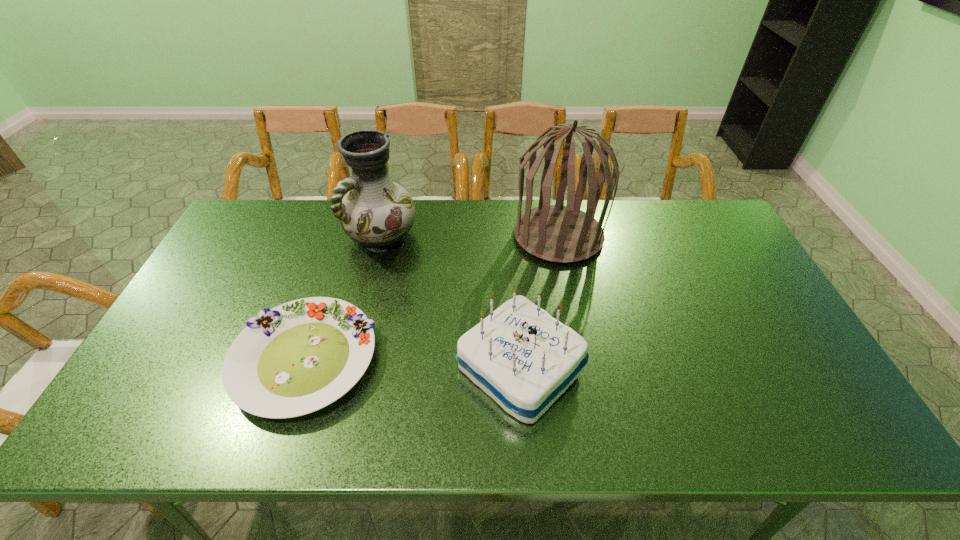
The image size is (960, 540). I want to click on birthday cake that is at the near edge, so click(x=522, y=357).

The width and height of the screenshot is (960, 540). Find the location of `salad plate located at the near edge`. salad plate located at the near edge is located at coordinates (299, 357).

Where is `free space at the far edge of the desktop`? This screenshot has height=540, width=960. free space at the far edge of the desktop is located at coordinates pyautogui.click(x=632, y=215).

In the image, there is a desktop. Where is `vacant region at the near edge`? The image size is (960, 540). vacant region at the near edge is located at coordinates (614, 418).

This screenshot has width=960, height=540. Identify the location of vacant space at the left edge of the desktop. (215, 284).

Image resolution: width=960 pixels, height=540 pixels. In the image, there is a desktop. What are the coordinates of `free space at the right edge` in the screenshot? It's located at (755, 350).

The image size is (960, 540). Identify the location of free location at the far right corner. (689, 243).

Find the location of a particular element. The height and width of the screenshot is (540, 960). vacant region between the third shortest object and the birthday cake is located at coordinates pyautogui.click(x=450, y=302).

This screenshot has height=540, width=960. What are the coordinates of `unoccupied position between the birdcage and the vase` in the screenshot? It's located at (469, 236).

Locate an element on the screen. This screenshot has height=540, width=960. vacant space in between the birdcage and the third shortest object is located at coordinates (469, 236).